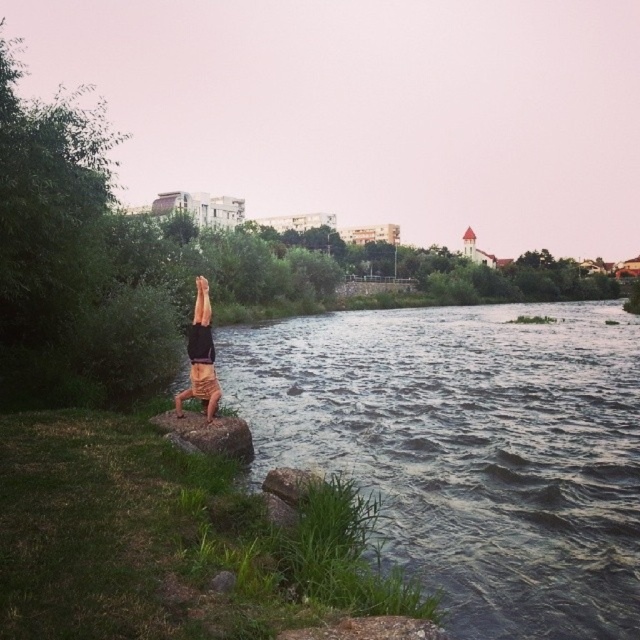
Is dark gray water at center thinner than tan shorts at center?

No, dark gray water at center is not thinner than tan shorts at center.

Is point (420, 308) positioned behind point (188, 337)?

Yes, it is.

Locate an element on the screen. dark gray water at center is located at coordinates (468, 449).